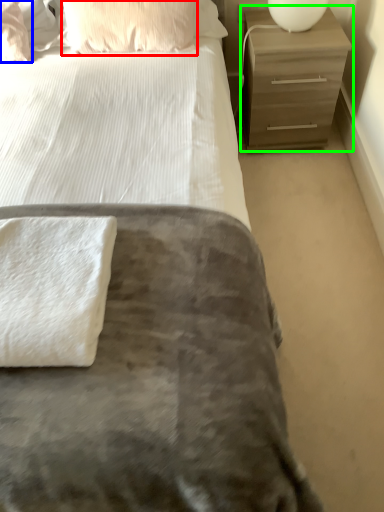
Question: Estimate the real-world distances between objects in this image. Which object is farther from pillow (highlighted by a red box), pillow (highlighted by a blue box) or chest of drawers (highlighted by a green box)?

Choices:
 (A) pillow
 (B) chest of drawers

Answer: (B)